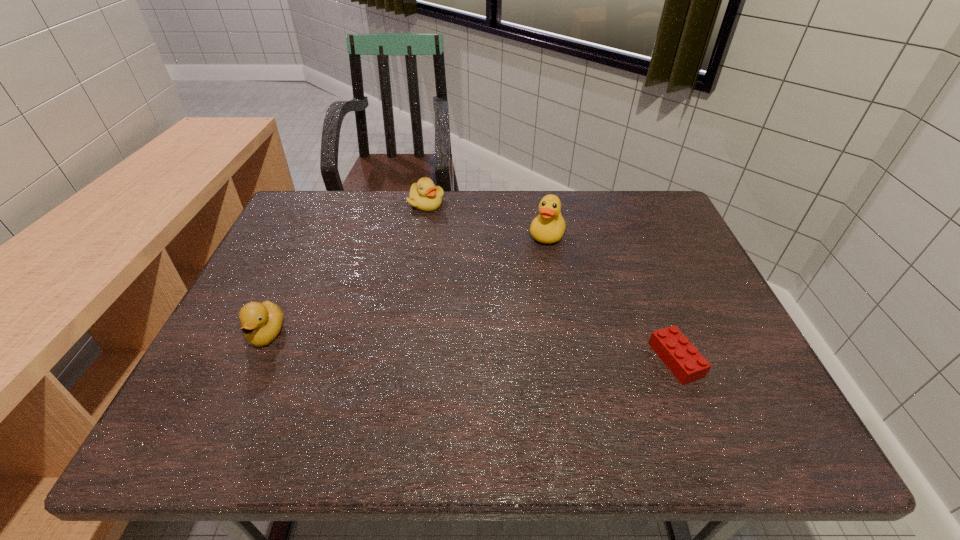
Where is `object present at the right edge`? The width and height of the screenshot is (960, 540). object present at the right edge is located at coordinates (682, 358).

Image resolution: width=960 pixels, height=540 pixels. In order to click on object present at the near right corner in this screenshot , I will do `click(682, 358)`.

Find the location of a particular element. This screenshot has width=960, height=540. vacant space at the far edge is located at coordinates [x=486, y=218].

Locate an element on the screen. The width and height of the screenshot is (960, 540). vacant area at the near edge is located at coordinates (569, 375).

This screenshot has width=960, height=540. What are the coordinates of `free location at the left edge of the desktop` in the screenshot? It's located at (318, 268).

I want to click on free space at the right edge, so click(x=726, y=366).

In the image, there is a desktop. Where is `vacant space at the far left corner`? Image resolution: width=960 pixels, height=540 pixels. vacant space at the far left corner is located at coordinates pos(314,228).

This screenshot has width=960, height=540. Identify the location of free space at the far right corner. (644, 198).

Identify the location of free spot between the shortest object and the third object from left to right. (612, 297).

I want to click on blank region between the tallest object and the nearer duckling, so click(x=407, y=284).